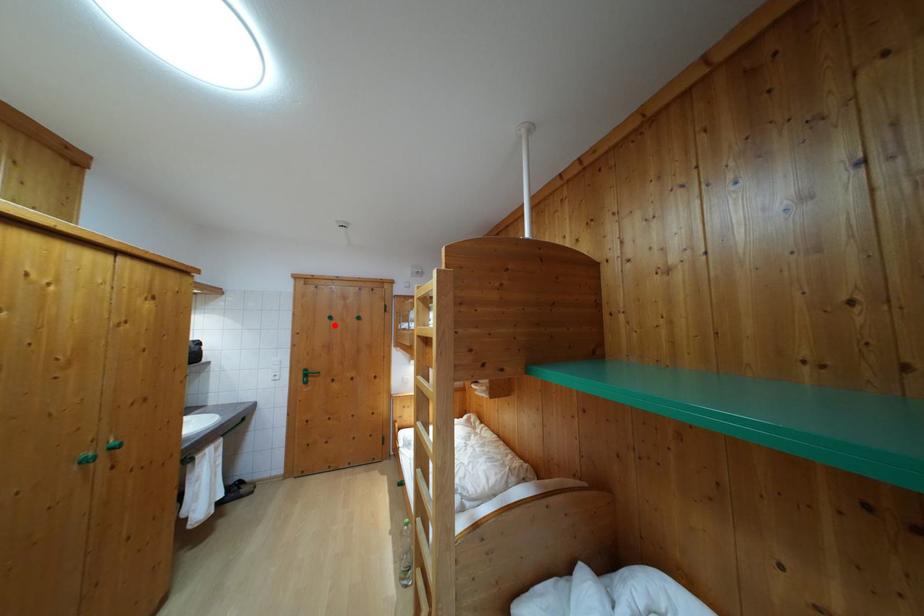
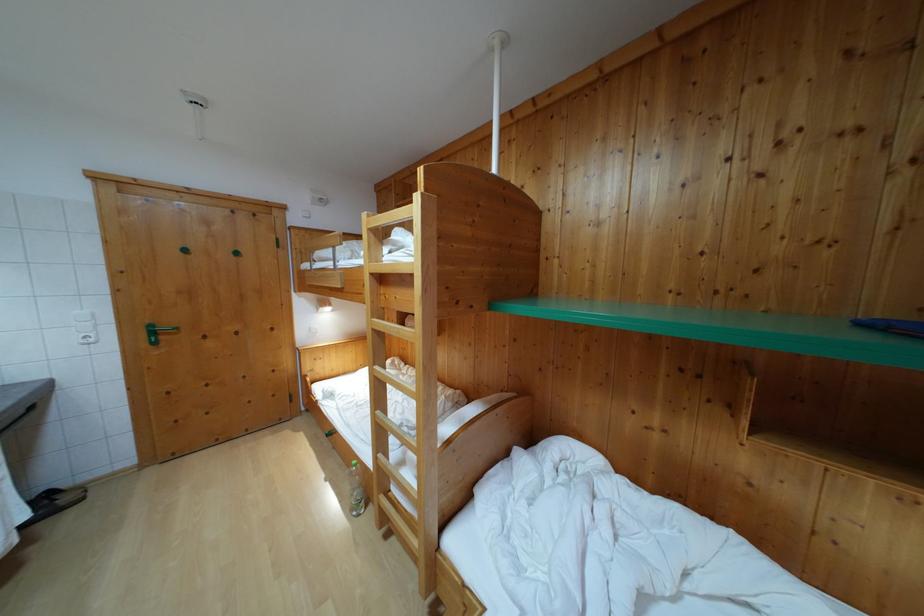
In the second image, find the point that corresponds to the highlighted location in the first image.

(189, 257)